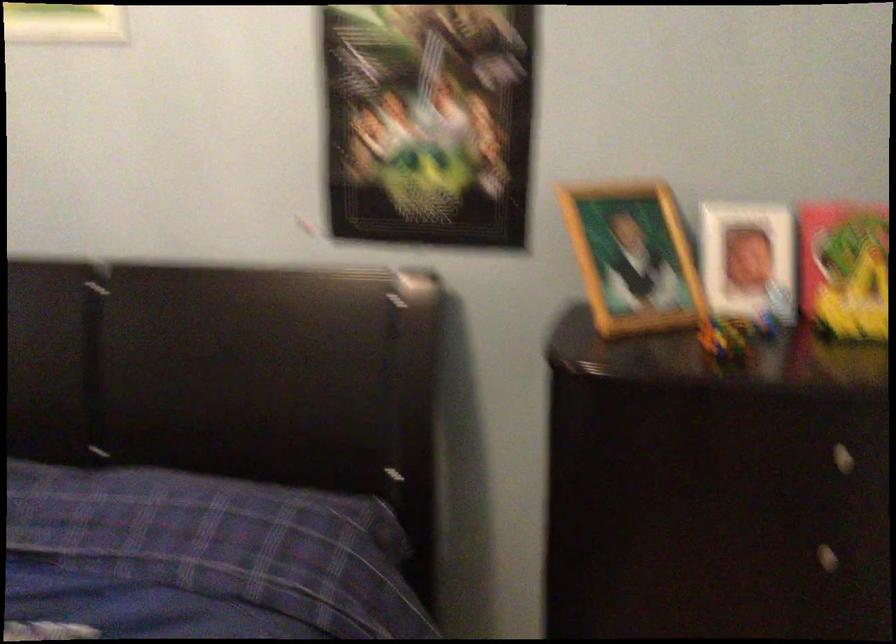
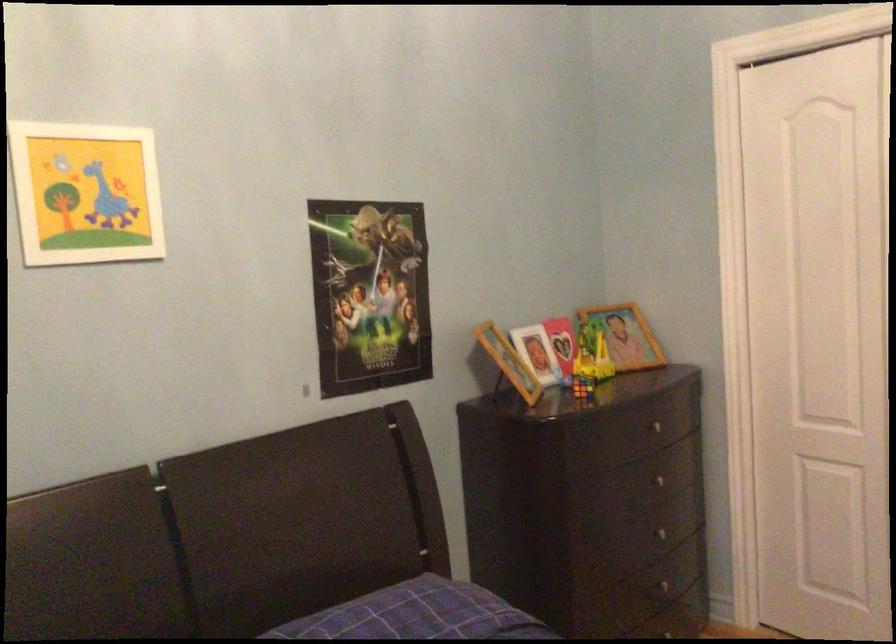
Locate, in the second image, the point that corresponds to pixel 719 330 in the first image.

(582, 386)